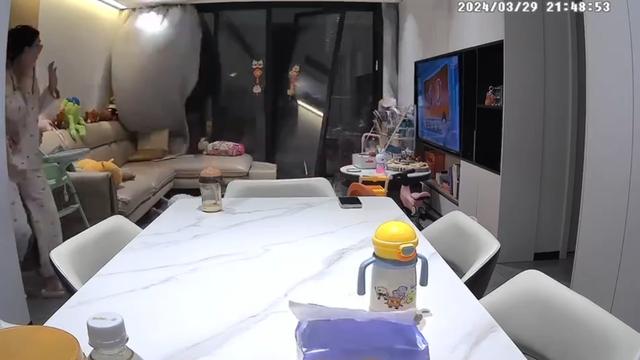
Locate an element on the screen. The width and height of the screenshot is (640, 360). sofa is located at coordinates (150, 175).